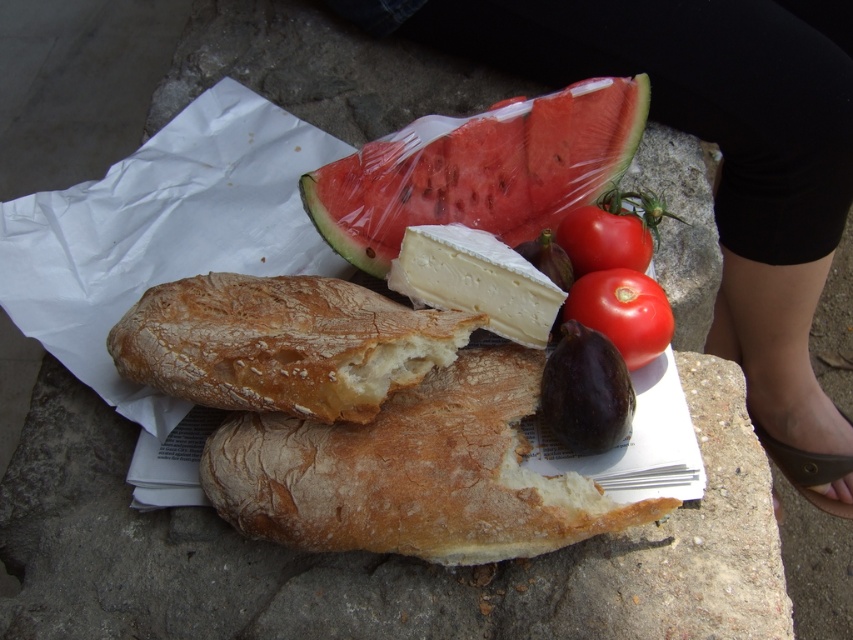
Is red translucent watermelon at upper center below shiny red tomato at center?

Actually, red translucent watermelon at upper center is above shiny red tomato at center.

Who is taller, red translucent watermelon at upper center or shiny red tomato at center?

With more height is red translucent watermelon at upper center.

Is point (619, 116) less distant than point (618, 204)?

No, (619, 116) is further to viewer.

Identify the location of red translucent watermelon at upper center. (479, 170).

Is white creamy cheese at center to the left of purple matte eggplant at center from the viewer's perspective?

Correct, you'll find white creamy cheese at center to the left of purple matte eggplant at center.

Between point (457, 253) and point (604, 426), which one is positioned behind?

The point (457, 253) is more distant.

Where is `white creamy cheese at center`? Image resolution: width=853 pixels, height=640 pixels. white creamy cheese at center is located at coordinates (476, 280).

Is red matte tomato at center to the right of purple matte fig at center from the viewer's perspective?

Indeed, red matte tomato at center is positioned on the right side of purple matte fig at center.

How distant is red matte tomato at center from purple matte fig at center?

red matte tomato at center and purple matte fig at center are 2.86 inches apart.

This screenshot has height=640, width=853. What do you see at coordinates (624, 310) in the screenshot? I see `red matte tomato at center` at bounding box center [624, 310].

I want to click on red matte tomato at center, so click(x=624, y=310).